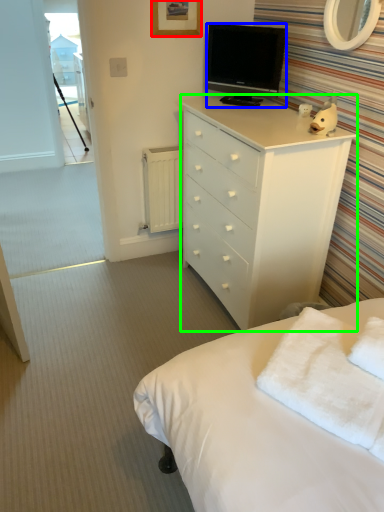
Question: Estimate the real-world distances between objects in this image. Which object is closer to picture frame (highlighted by a red box), television (highlighted by a blue box) or chest of drawers (highlighted by a green box)?

Choices:
 (A) television
 (B) chest of drawers

Answer: (A)